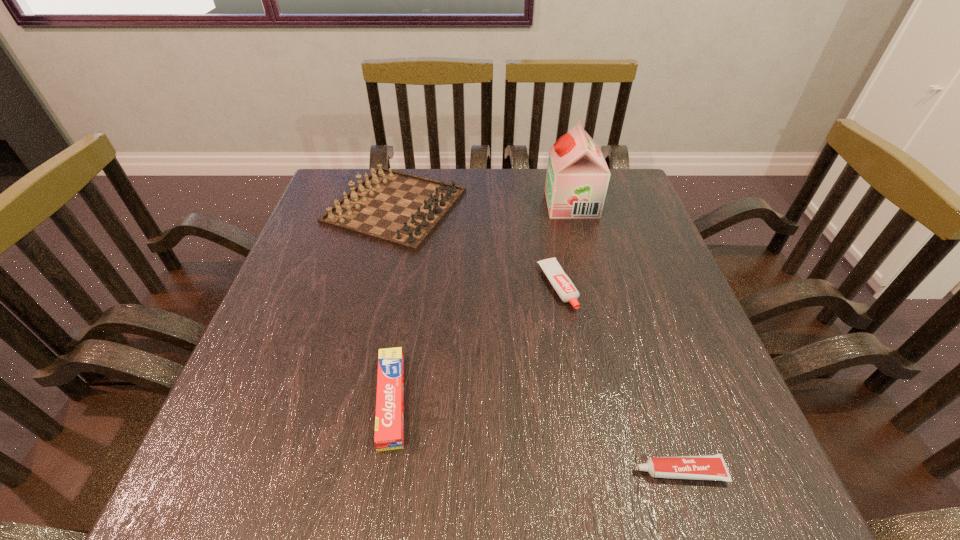
You are a GUI agent. You are given a task and a screenshot of the screen. Output one action in this format:
    pyautogui.click(x=<x>, y=<y>)
    Task: Click on the soya milk
    The image size is (960, 540).
    Given the screenshot: What is the action you would take?
    pyautogui.click(x=577, y=178)

The width and height of the screenshot is (960, 540). I want to click on the fourth shortest object, so click(x=390, y=206).

Image resolution: width=960 pixels, height=540 pixels. I want to click on the farthest toothpaste, so click(x=562, y=284).

The width and height of the screenshot is (960, 540). In order to click on the third farthest object in this screenshot , I will do pyautogui.click(x=562, y=284).

Locate an element on the screen. the second nearest object is located at coordinates (389, 421).

Locate an element on the screen. the second nearest toothpaste is located at coordinates (389, 421).

At what (x,y) coordinates should I click in order to perform the action: click on the shortest object. Please return your answer as a coordinate pair (x, y). The height and width of the screenshot is (540, 960). Looking at the image, I should click on (698, 467).

Locate an element on the screen. This screenshot has width=960, height=540. the shortest toothpaste is located at coordinates (698, 467).

Image resolution: width=960 pixels, height=540 pixels. Identify the location of vacant space situated 0.370m with the cap open on the soya milk. (412, 204).

Identify the location of vacant region located with the cap open on the soya milk. (448, 204).